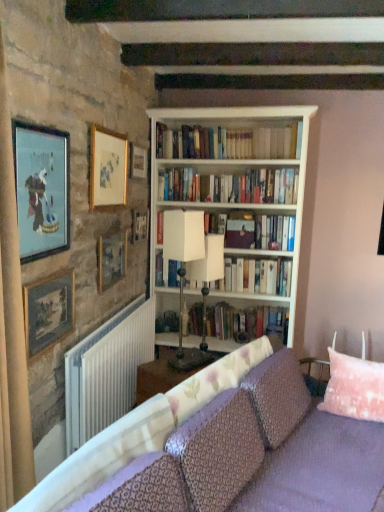
Question: Is wooden picture frame at upper center, the 6th picture frame positioned from the front, thinner than white plastic radiator at lower left?

Choices:
 (A) no
 (B) yes

Answer: (B)

Question: Would you say wooden picture frame at upper center, the 6th picture frame positioned from the front, contains white plastic radiator at lower left?

Choices:
 (A) yes
 (B) no

Answer: (B)

Question: From the image's perspective, is wooden picture frame at upper center, the 1th picture frame viewed from the back, over white plastic radiator at lower left?

Choices:
 (A) yes
 (B) no

Answer: (A)

Question: Does wooden picture frame at upper center, the 6th picture frame positioned from the front, appear on the right side of white plastic radiator at lower left?

Choices:
 (A) no
 (B) yes

Answer: (B)

Question: From the image's perspective, is wooden picture frame at upper center, the 1th picture frame viewed from the back, located beneath white plastic radiator at lower left?

Choices:
 (A) yes
 (B) no

Answer: (B)

Question: Does point (213, 270) appear closer or farther from the camera than point (263, 272)?

Choices:
 (A) farther
 (B) closer

Answer: (B)

Question: Is white fabric table lamp at center, the 2th table lamp when ordered from left to right, taller or shorter than white paper book at center, the second book when ordered from bottom to top?

Choices:
 (A) tall
 (B) short

Answer: (A)

Question: From a real-world perspective, is white fabric table lamp at center, the first table lamp positioned from the right, positioned above or below white paper book at center, the second book when ordered from bottom to top?

Choices:
 (A) below
 (B) above

Answer: (A)

Question: Visually, is white fabric table lamp at center, the first table lamp positioned from the right, positioned to the left or to the right of white paper book at center, which appears as the third book when viewed from the top?

Choices:
 (A) right
 (B) left

Answer: (B)

Question: In the image, is white wooden bookcase at center on the left side or the right side of purple fabric couch at lower center?

Choices:
 (A) left
 (B) right

Answer: (A)

Question: Which is correct: white wooden bookcase at center is inside purple fabric couch at lower center, or outside of it?

Choices:
 (A) inside
 (B) outside

Answer: (B)

Question: From the image's perspective, relative to purple fabric couch at lower center, is white wooden bookcase at center above or below?

Choices:
 (A) below
 (B) above

Answer: (B)

Question: In the image, is white wooden bookcase at center positioned in front of or behind purple fabric couch at lower center?

Choices:
 (A) behind
 (B) front

Answer: (A)

Question: Considering the positions of point (64, 169) and point (41, 335), is point (64, 169) closer or farther from the camera than point (41, 335)?

Choices:
 (A) farther
 (B) closer

Answer: (A)

Question: Relative to wooden picture frame at upper left, marked as the second picture frame in a front-to-back arrangement, is matte gold picture frame at upper left, which is the 1th picture frame from front to back, in front or behind?

Choices:
 (A) front
 (B) behind

Answer: (A)